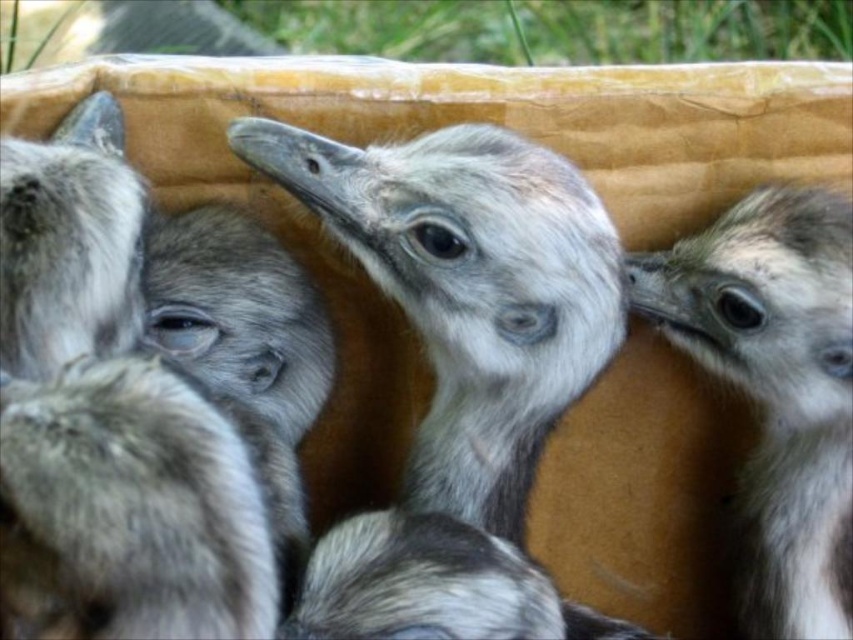
What do you see at coordinates (469, 289) in the screenshot? The width and height of the screenshot is (853, 640). I see `gray downy ostrich at center` at bounding box center [469, 289].

How distant is gray downy ostrich at center from gray fluffy ostrich at center?

6.98 inches

You are a GUI agent. You are given a task and a screenshot of the screen. Output one action in this format:
    pyautogui.click(x=<x>, y=<y>)
    Task: Click on the gray downy ostrich at center
    Image resolution: width=853 pixels, height=640 pixels.
    Given the screenshot: What is the action you would take?
    pyautogui.click(x=469, y=289)